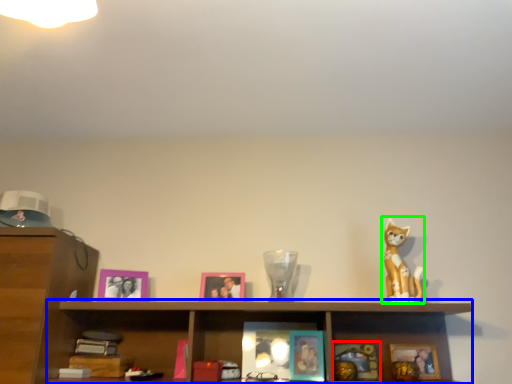
Question: Which object is the farthest from picture frame (highlighted by a red box)? Choose among these: cabinet (highlighted by a blue box) or toy (highlighted by a green box).

Choices:
 (A) cabinet
 (B) toy

Answer: (A)